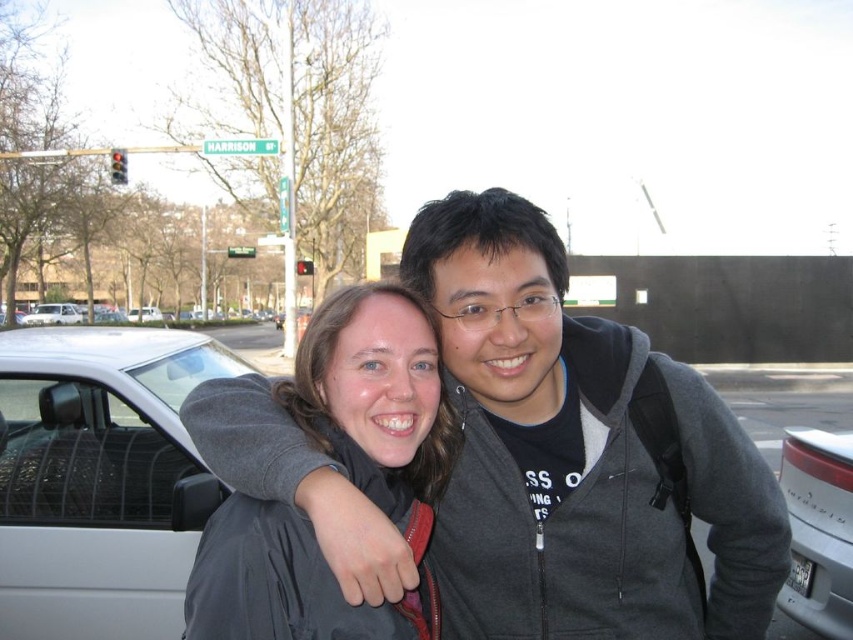
Is point (59, 320) closer to camera compared to point (154, 307)?

Yes, point (59, 320) is in front of point (154, 307).

Is the position of white matte van at left more distant than that of silver metallic sedan at left?

No, white matte van at left is in front of silver metallic sedan at left.

Who is more forward, (38, 321) or (149, 317)?

Point (38, 321) is more forward.

Where is `white matte van at left`? white matte van at left is located at coordinates (53, 314).

Identify the location of matte gray jacket at center. The image size is (853, 640). (346, 477).

Between matte gray jacket at center and silver metallic car at lower right, which one has more height?

silver metallic car at lower right

Find the location of a particular element. The height and width of the screenshot is (640, 853). matte gray jacket at center is located at coordinates (346, 477).

Between point (628, 582) and point (386, 484), which one is positioned behind?

The point (628, 582) is behind.

Is gray zip-up hoodie at center to the right of matte gray jacket at center from the viewer's perspective?

Yes, gray zip-up hoodie at center is to the right of matte gray jacket at center.

Which is behind, point (543, 461) or point (252, 577)?

The point (543, 461) is behind.

At what (x,y) coordinates should I click in order to perform the action: click on gray zip-up hoodie at center. Please return your answer as a coordinate pair (x, y). Looking at the image, I should click on (576, 454).